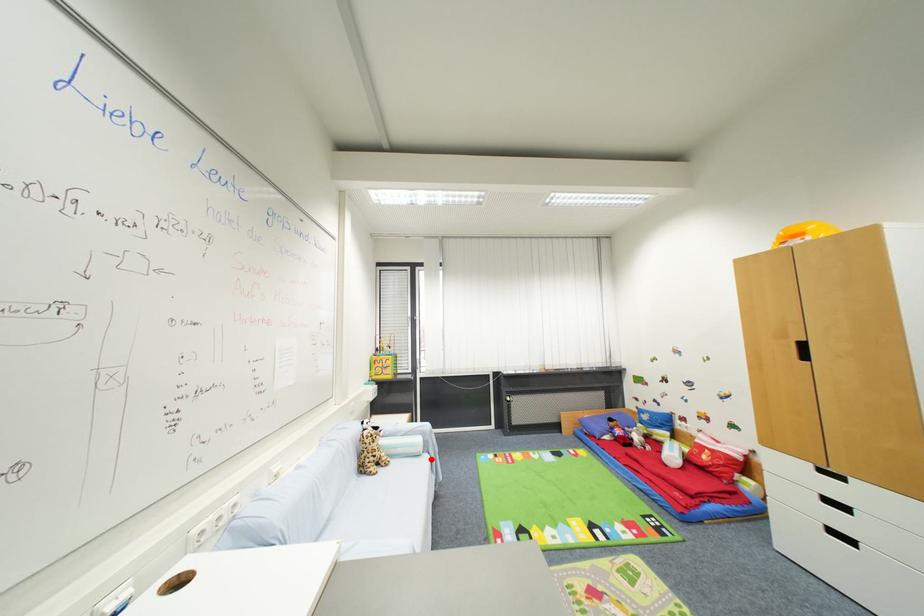
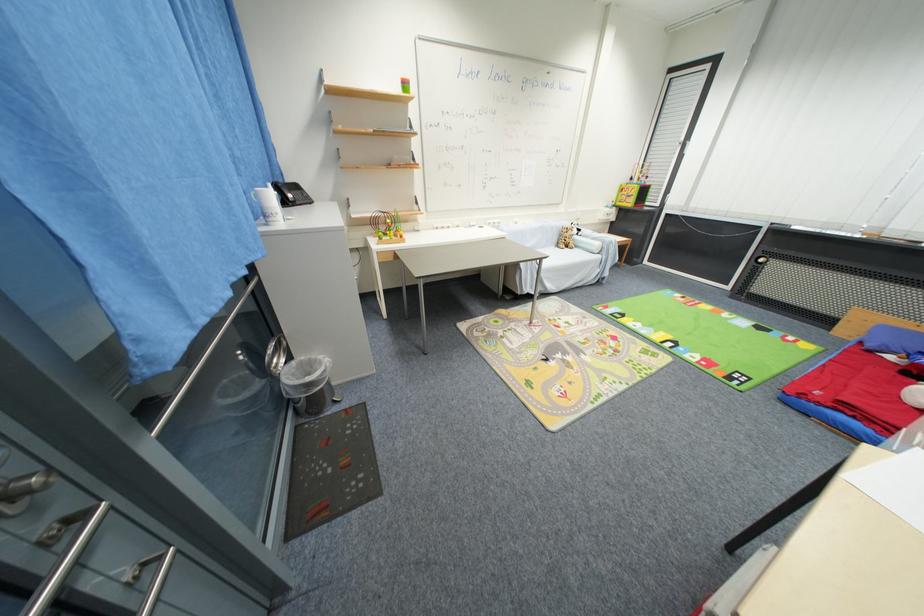
In the second image, find the point that corresponds to the highlighted location in the first image.

(603, 259)